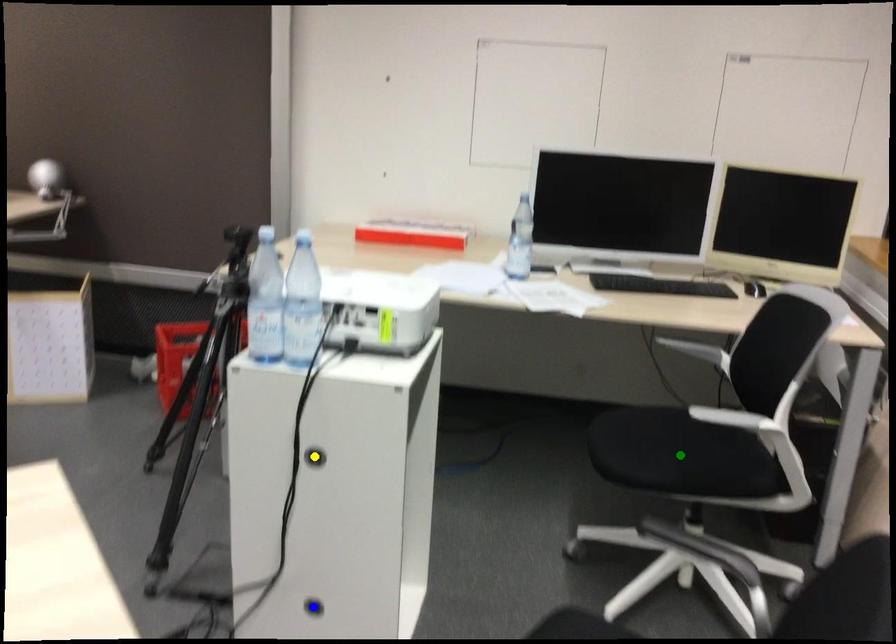
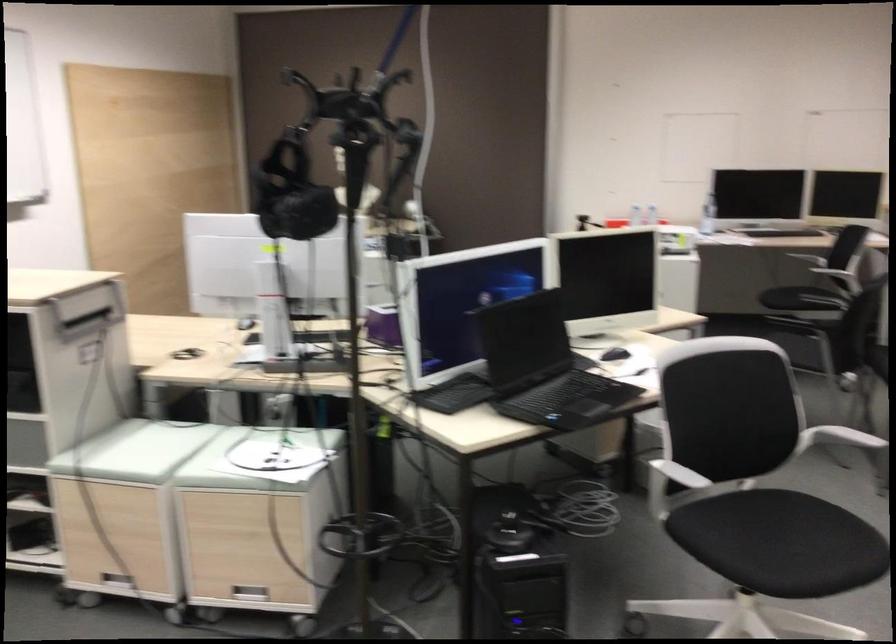
I am providing you with two images of the same scene from different viewpoints. Three points are marked in image1. Which point corresponds to a part or object that is occluded in image2?In image1, three points are marked. Which of them correspond to a part or object that is occluded in image2?Among the three points shown in image1, which one corresponds to a part or object that is no longer visible due to occlusion in image2?

green point, blue point, yellow point